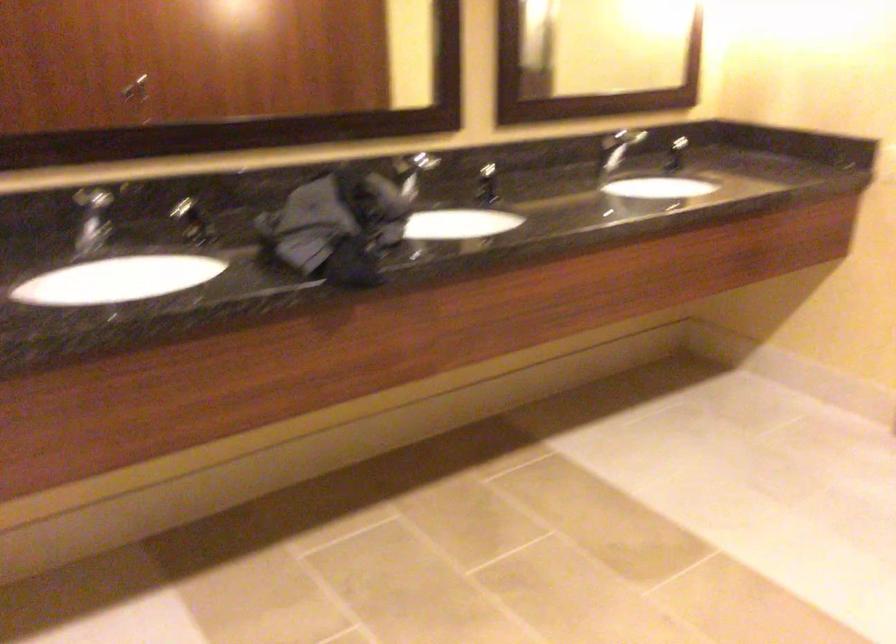
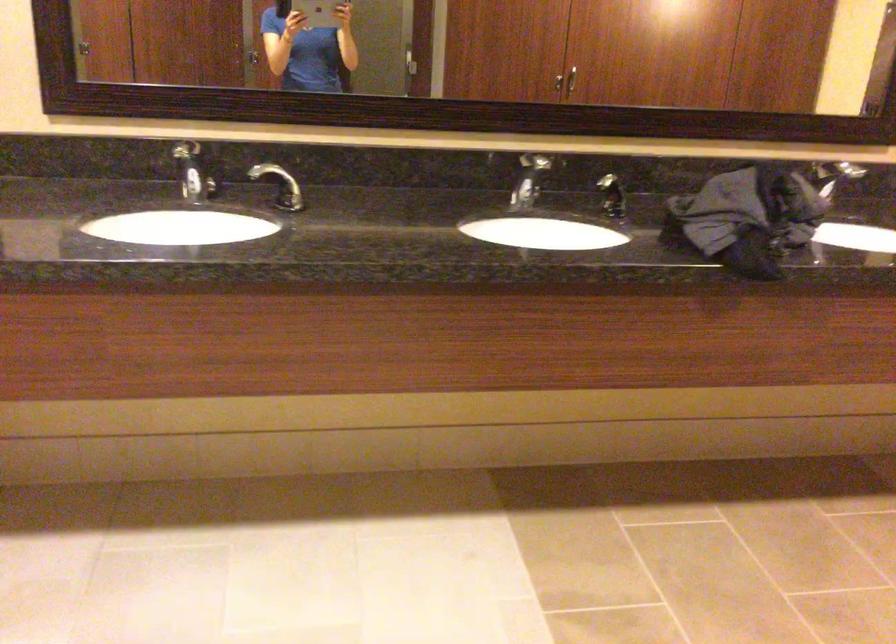
Question: What movement of the cameraman would produce the second image?

Choices:
 (A) Left
 (B) Right
 (C) Forward
 (D) Backward

Answer: (D)